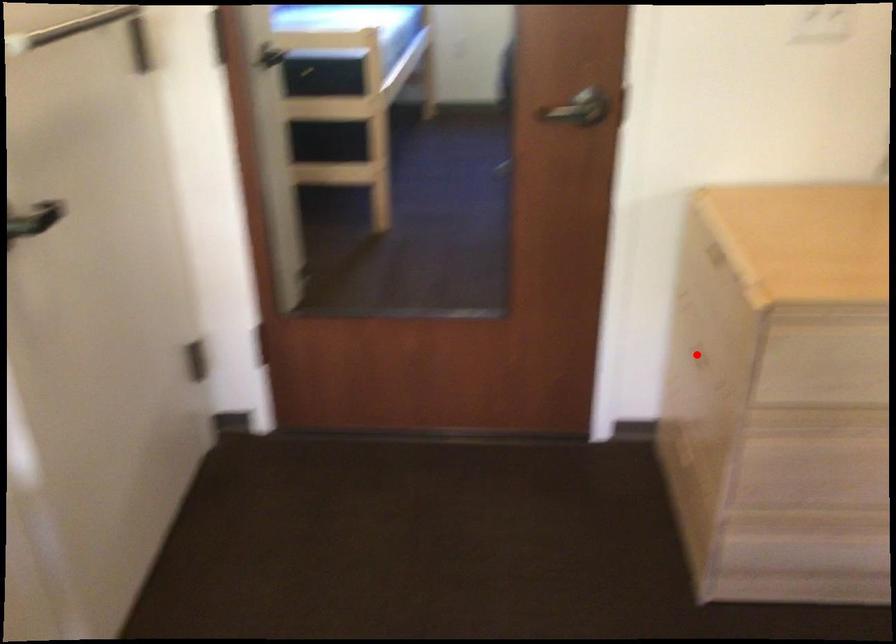
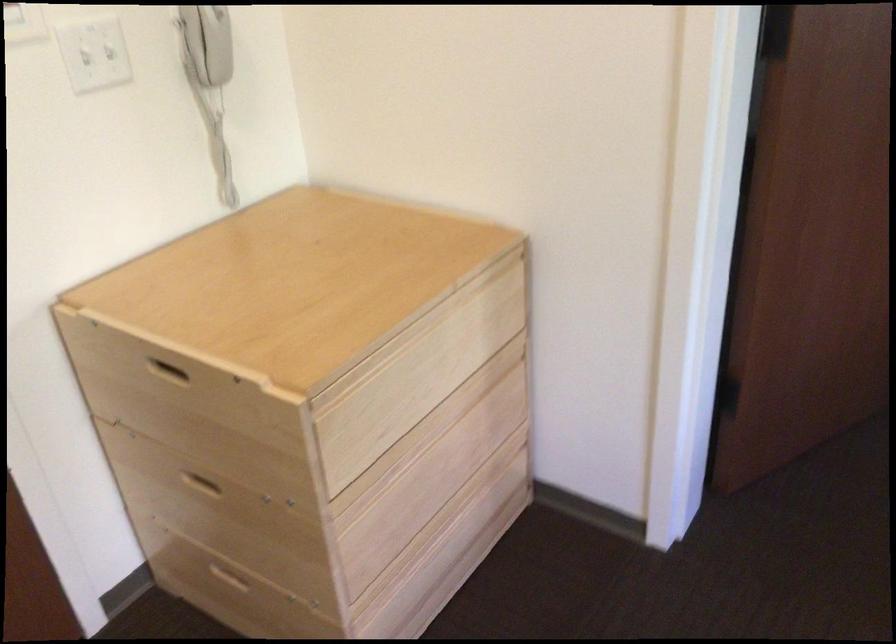
The point at the highlighted location is marked in the first image. Where is the corresponding point in the second image?

(201, 483)